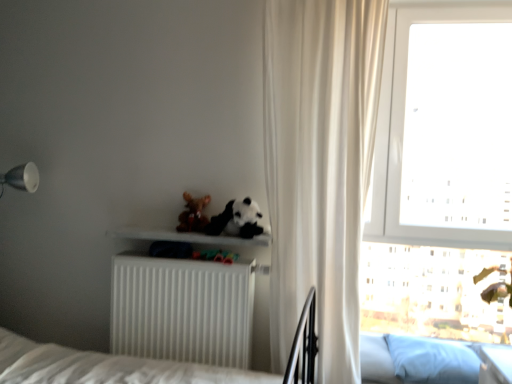
You are a GUI agent. You are given a task and a screenshot of the screen. Output one action in this format:
    pyautogui.click(x=<x>, y=<y>)
    Task: Click on the empty space that is ontop of transparent glass window at upper right
    
    Given the screenshot: What is the action you would take?
    (483, 6)